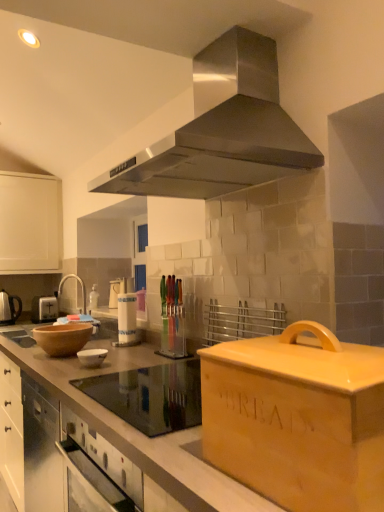
Locate an element on the screen. The image size is (384, 512). matte yellow bread box at center is located at coordinates (297, 418).

Measure the distance between white glossy sink at left and camera.

The depth of white glossy sink at left is 6.60 feet.

In order to face white glossy bowl at center, should I rotate leftwards or rightwards?

Turn left approximately 12.636 degrees to face it.

The height and width of the screenshot is (512, 384). What do you see at coordinates (136, 387) in the screenshot?
I see `brown matte wood at center, which appears as the second countertop when viewed from the front` at bounding box center [136, 387].

I want to click on white plastic toaster at left, so click(x=44, y=309).

Find the location of a particular element. The height and width of the screenshot is (512, 384). cabinetry above the matte black kettle at left (from the image's perspective) is located at coordinates (30, 222).

In the image, is white matte cabinet at upper left on the left side or the right side of matte black kettle at left?

→ In the image, white matte cabinet at upper left appears on the right side of matte black kettle at left.

How far apart are white matte cabinet at upper left and matte black kettle at left?

white matte cabinet at upper left is 21.98 inches away from matte black kettle at left.

Is matte black kettle at left a part of white matte cabinet at upper left?

That's incorrect, matte black kettle at left is not inside white matte cabinet at upper left.

From the image's perspective, would you say matte brown countertop at center, which ranks as the second countertop in back-to-front order, is positioned over brown wooden mixing bowl at left?

No, from the image's perspective, matte brown countertop at center, which ranks as the second countertop in back-to-front order, is not above brown wooden mixing bowl at left.

Is matte brown countertop at center, which is counted as the 1th countertop, starting from the front, located outside brown wooden mixing bowl at left?

That's correct, matte brown countertop at center, which is counted as the 1th countertop, starting from the front, is outside of brown wooden mixing bowl at left.

Which point is more distant from viewer, (56,372) or (88,328)?

Point (88,328)

Consider the image. Choose the correct answer: Is matte brown countertop at center, which ranks as the second countertop in back-to-front order, inside matte yellow bread box at center or outside it?

matte brown countertop at center, which ranks as the second countertop in back-to-front order, exists outside the volume of matte yellow bread box at center.

Relative to matte yellow bread box at center, is matte brown countertop at center, which is counted as the 1th countertop, starting from the front, in front or behind?

Clearly, matte brown countertop at center, which is counted as the 1th countertop, starting from the front, is behind matte yellow bread box at center.

Is matte brown countertop at center, which is counted as the 1th countertop, starting from the front, shorter than matte yellow bread box at center?

Incorrect, the height of matte brown countertop at center, which is counted as the 1th countertop, starting from the front, does not fall short of that of matte yellow bread box at center.

Considering the relative positions of white glossy sink at left and brown matte wood at center, which is the first countertop from back to front, in the image provided, is white glossy sink at left to the left of brown matte wood at center, which is the first countertop from back to front, from the viewer's perspective?

Yes, white glossy sink at left is to the left of brown matte wood at center, which is the first countertop from back to front.

Between point (87, 317) and point (108, 391), which one is positioned behind?

The point (87, 317) is behind.

From a real-world perspective, is white glossy sink at left positioned under brown matte wood at center, which is the first countertop from back to front, based on gravity?

No.

Considering their positions, is white glossy sink at left located in front of or behind brown matte wood at center, which is the first countertop from back to front?

white glossy sink at left is positioned farther from the viewer than brown matte wood at center, which is the first countertop from back to front.

From the image's perspective, would you say brown wooden mixing bowl at left is positioned over stainless steel range hood at upper center?

No, from the image's perspective, brown wooden mixing bowl at left is not above stainless steel range hood at upper center.

What's the angular difference between brown wooden mixing bowl at left and stainless steel range hood at upper center's facing directions?

The facing directions of brown wooden mixing bowl at left and stainless steel range hood at upper center are 1.51 degrees apart.

Would you say brown wooden mixing bowl at left is a long distance from stainless steel range hood at upper center?

Yes, brown wooden mixing bowl at left and stainless steel range hood at upper center are quite far apart.

From a real-world perspective, does brown wooden mixing bowl at left stand above stainless steel range hood at upper center?

Actually, brown wooden mixing bowl at left is physically below stainless steel range hood at upper center in the real world.

Can you confirm if matte black kettle at left is shorter than brown matte wood at center, which appears as the second countertop when viewed from the front?

Indeed, matte black kettle at left has a lesser height compared to brown matte wood at center, which appears as the second countertop when viewed from the front.

Is matte black kettle at left facing away from brown matte wood at center, which is the first countertop from back to front?

matte black kettle at left does not have its back to brown matte wood at center, which is the first countertop from back to front.

Does matte black kettle at left have a smaller size compared to brown matte wood at center, which is the first countertop from back to front?

Indeed, matte black kettle at left has a smaller size compared to brown matte wood at center, which is the first countertop from back to front.

From the image's perspective, is matte black kettle at left under white matte cabinet at upper left?

Indeed, from the image's perspective, matte black kettle at left is shown beneath white matte cabinet at upper left.

The image size is (384, 512). What are the coordinates of `cabinetry lying behind the matte black kettle at left` in the screenshot? It's located at (30, 222).

Is white matte cabinet at upper left at the back of matte black kettle at left?

No.

Find the location of a particular element. This screenshot has width=384, height=512. cabinetry above the matte black kettle at left (from a real-world perspective) is located at coordinates (30, 222).

Where is `mixing bowl located on the left of matte brown countertop at center, which ranks as the second countertop in back-to-front order`? mixing bowl located on the left of matte brown countertop at center, which ranks as the second countertop in back-to-front order is located at coordinates (63, 338).

Based on their spatial positions, is white glossy bowl at center or matte yellow bread box at center further from matte black kettle at left?

matte yellow bread box at center is further to matte black kettle at left.

Estimate the real-world distances between objects in this image. Which object is further from white plastic toaster at left, stainless steel range hood at upper center or matte black kettle at left?

Based on the image, stainless steel range hood at upper center appears to be further to white plastic toaster at left.

Estimate the real-world distances between objects in this image. Which object is further from white plastic toaster at left, matte yellow bread box at center or brown matte wood at center, which appears as the second countertop when viewed from the front?

matte yellow bread box at center.

When comparing their distances from matte brown countertop at center, which ranks as the second countertop in back-to-front order, does white glossy bowl at center or white matte cabinet at upper left seem closer?

white glossy bowl at center is closer to matte brown countertop at center, which ranks as the second countertop in back-to-front order.

Which object lies further to the anchor point white glossy bowl at center, matte brown countertop at center, which ranks as the second countertop in back-to-front order, or stainless steel range hood at upper center?

stainless steel range hood at upper center is positioned further to the anchor white glossy bowl at center.

Estimate the real-world distances between objects in this image. Which object is closer to brown matte wood at center, which is the first countertop from back to front, white glossy bowl at center or stainless steel range hood at upper center?

white glossy bowl at center is positioned closer to the anchor brown matte wood at center, which is the first countertop from back to front.

Considering their positions, is brown wooden mixing bowl at left positioned further to white plastic toaster at left than matte brown countertop at center, which is counted as the 1th countertop, starting from the front?

Based on the image, matte brown countertop at center, which is counted as the 1th countertop, starting from the front, appears to be further to white plastic toaster at left.

In the scene shown: Considering their positions, is matte black kettle at left positioned closer to matte brown countertop at center, which ranks as the second countertop in back-to-front order, than stainless steel range hood at upper center?

stainless steel range hood at upper center is closer to matte brown countertop at center, which ranks as the second countertop in back-to-front order.

You are a GUI agent. You are given a task and a screenshot of the screen. Output one action in this format:
    pyautogui.click(x=<x>, y=<y>)
    Task: Click on the mixing bowl between brown matte wood at center, which appears as the second countertop when viewed from the front, and white glossy sink at left in the front-back direction
    This screenshot has height=512, width=384.
    Given the screenshot: What is the action you would take?
    pyautogui.click(x=63, y=338)

You are a GUI agent. You are given a task and a screenshot of the screen. Output one action in this format:
    pyautogui.click(x=<x>, y=<y>)
    Task: Click on the bowl positioned between matte yellow bread box at center and white matte cabinet at upper left from near to far
    The width and height of the screenshot is (384, 512).
    Given the screenshot: What is the action you would take?
    pyautogui.click(x=92, y=357)

Find the location of `home appliance between matte brown countertop at center, which ranks as the second countertop in back-to-front order, and matte black kettle at left in the front-back direction`. home appliance between matte brown countertop at center, which ranks as the second countertop in back-to-front order, and matte black kettle at left in the front-back direction is located at coordinates (222, 130).

I want to click on countertop positioned between matte brown countertop at center, which is counted as the 1th countertop, starting from the front, and brown wooden mixing bowl at left from near to far, so click(136, 387).